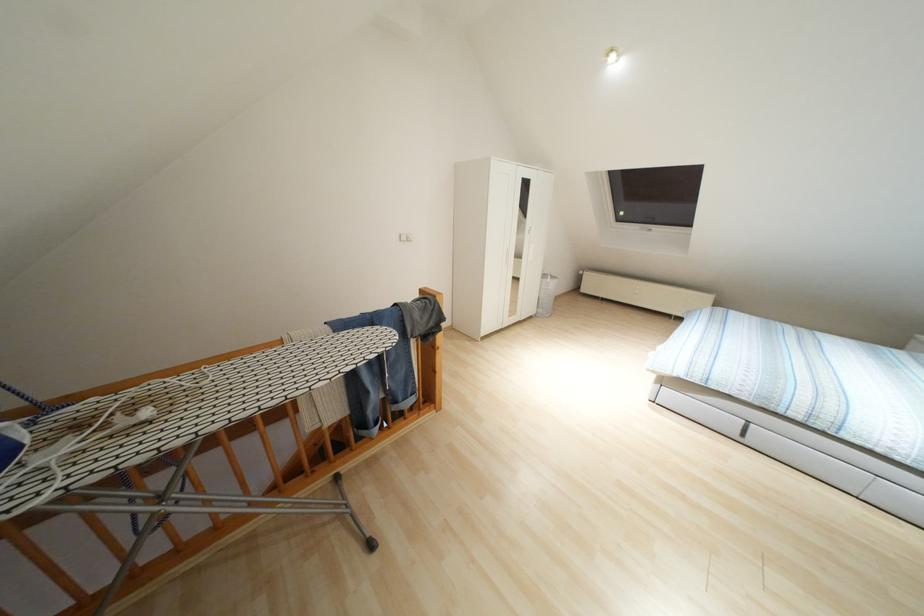
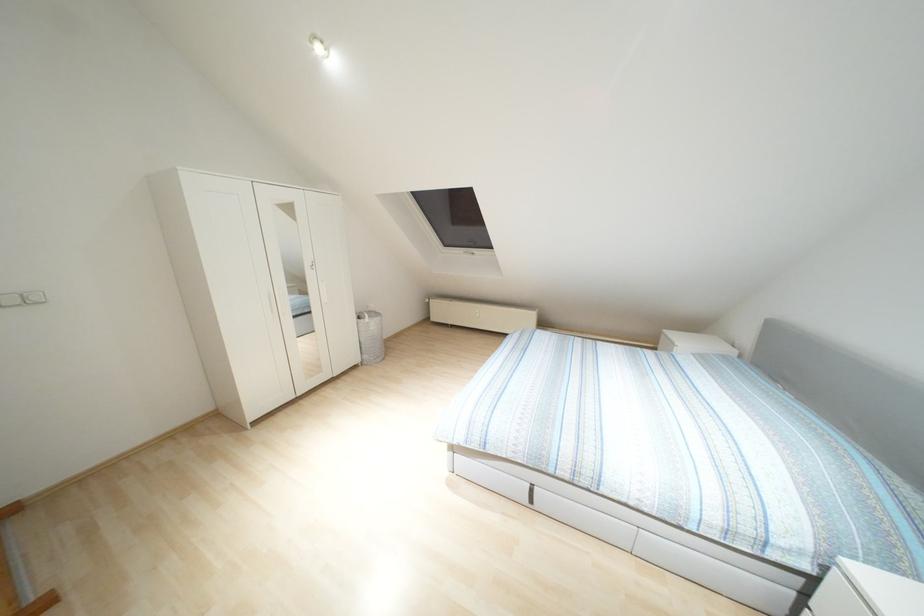
Question: In a continuous first-person perspective shot, in which direction is the camera moving?

Choices:
 (A) Left
 (B) Right
 (C) Forward
 (D) Backward

Answer: (B)